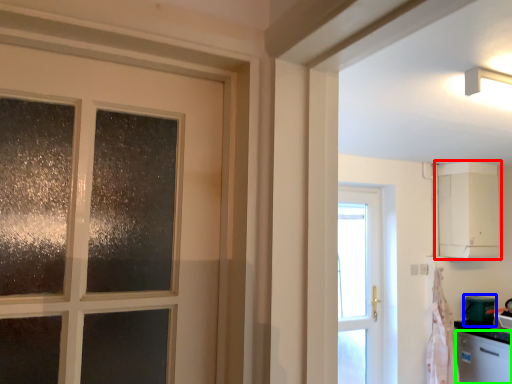
Question: Which object is the farthest from cabinetry (highlighted by a red box)? Choose among these: appliance (highlighted by a blue box) or dish washer (highlighted by a green box).

Choices:
 (A) appliance
 (B) dish washer

Answer: (B)